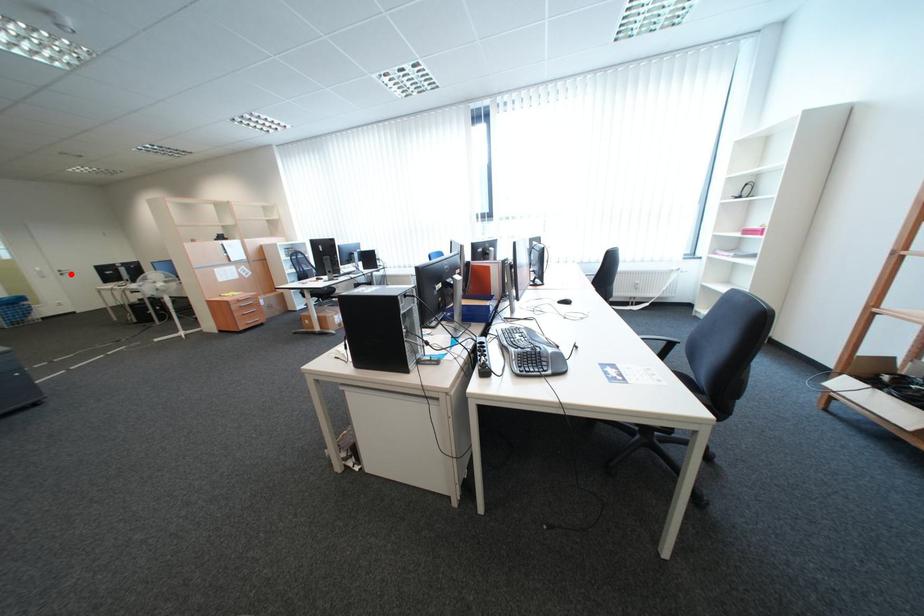
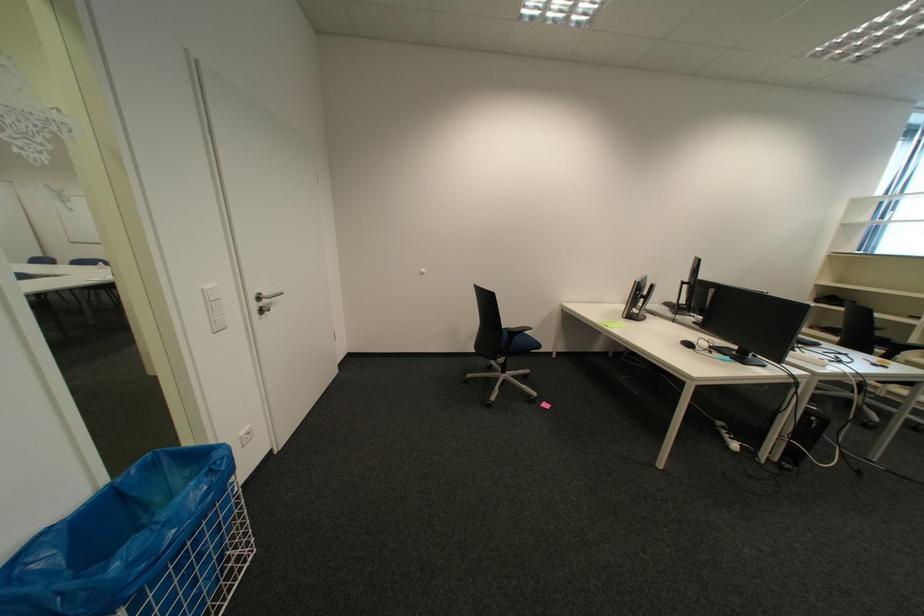
Question: A red point is marked in image1. In image2, is the corresponding 3D point closer to the camera or farther? Reply with the corresponding letter.

Choices:
 (A) The corresponding 3D point is closer.
 (B) The corresponding 3D point is farther.

Answer: (A)